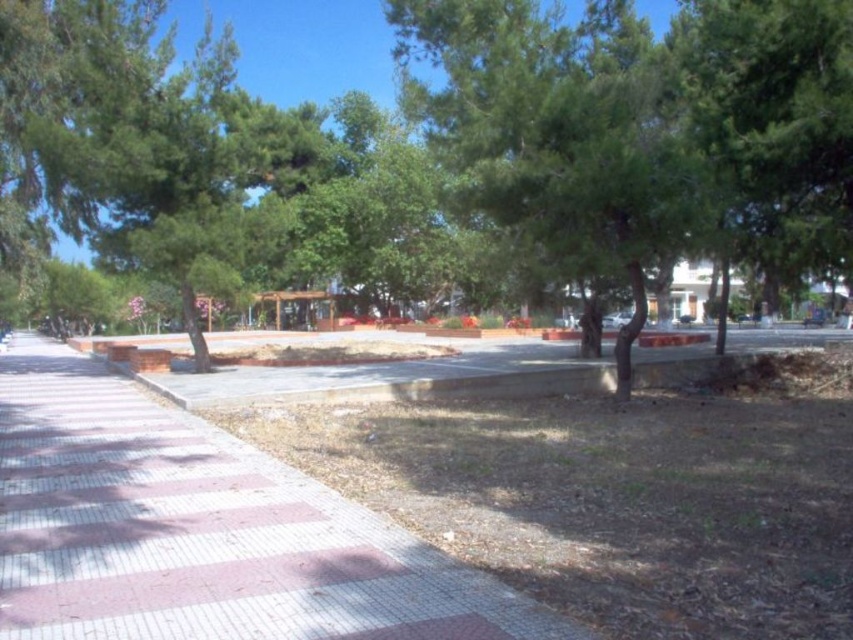
Question: Is the position of green leafy tree at center more distant than that of red brick pavement at left?

Choices:
 (A) no
 (B) yes

Answer: (B)

Question: Can you confirm if green leafy tree at center is positioned to the right of green leafy tree at left?

Choices:
 (A) no
 (B) yes

Answer: (B)

Question: Which point is closer to the camera?

Choices:
 (A) (129, 49)
 (B) (13, 477)

Answer: (B)

Question: Which point is farther to the camera?

Choices:
 (A) (171, 205)
 (B) (445, 600)
 (C) (547, 92)

Answer: (A)

Question: Is red brick pavement at left wider than green leafy tree at left?

Choices:
 (A) yes
 (B) no

Answer: (B)

Question: Which object is positioned farthest from the green leafy tree at left?

Choices:
 (A) green leafy tree at center
 (B) red brick pavement at left

Answer: (B)